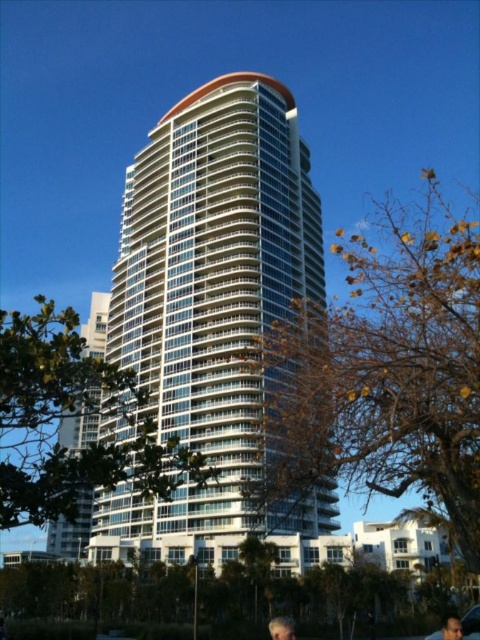
You are standing at the center of a park and want to take a photo of the white glass building at center. Which direction should you face to capture it in the frame?

The white glass building at center is located at point coordinates, so you should face the direction where the building is positioned to capture it in the frame.